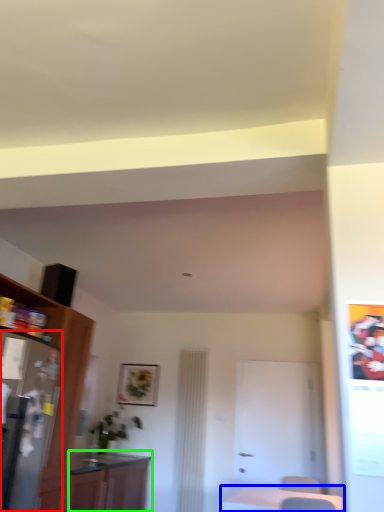
Question: Based on their relative distances, which object is farther from appliance (highlighted by a red box)? Choose from table (highlighted by a blue box) and cabinetry (highlighted by a green box).

Choices:
 (A) table
 (B) cabinetry

Answer: (A)